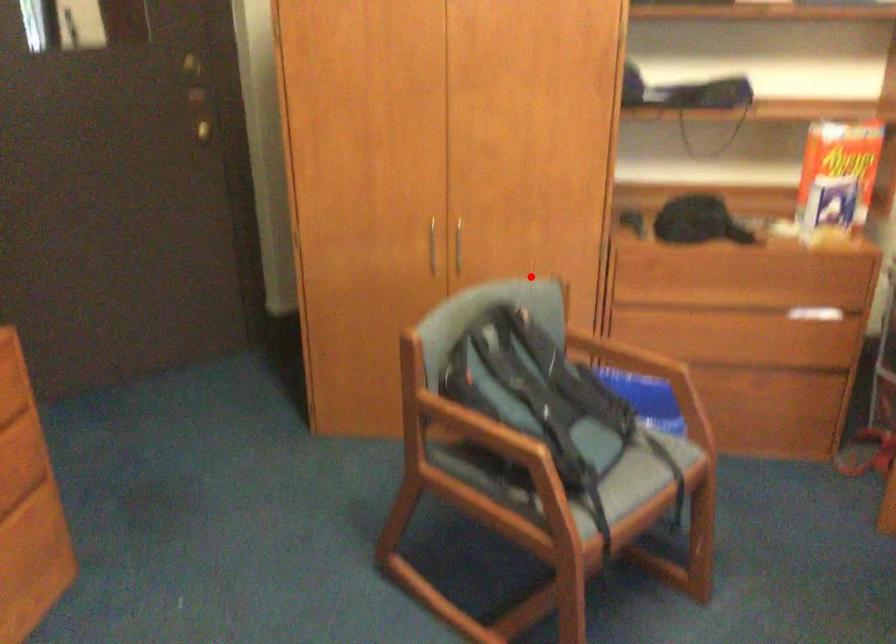
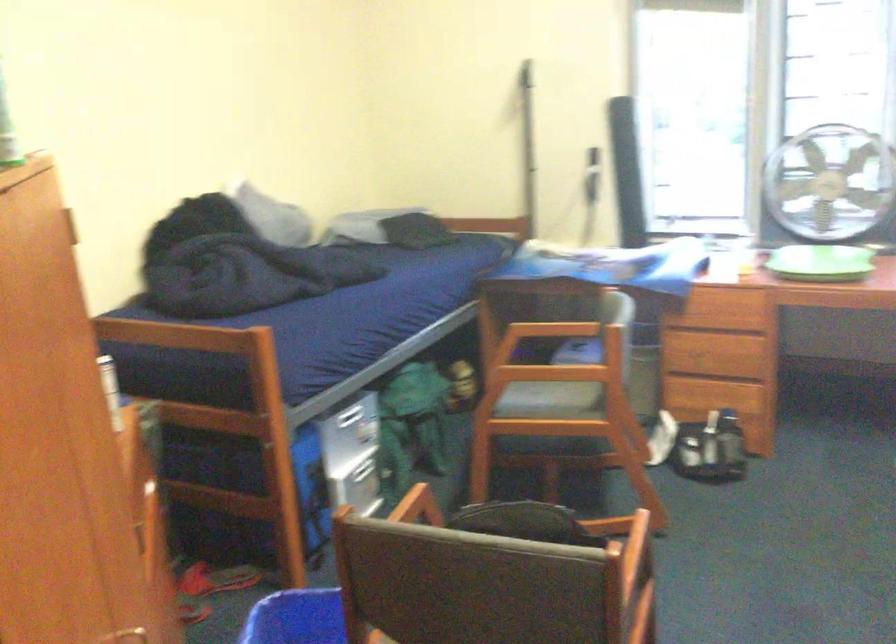
The point at the highlighted location is marked in the first image. Where is the corresponding point in the second image?

(141, 630)